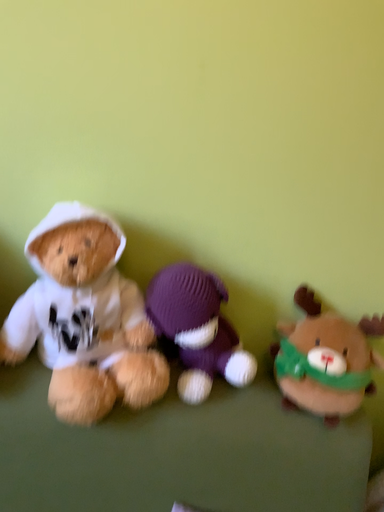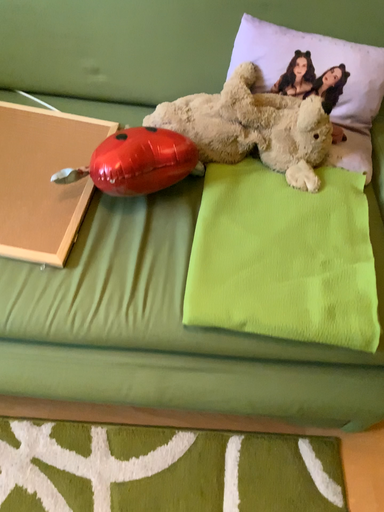
Question: Which way did the camera rotate in the video?

Choices:
 (A) rotated downward
 (B) rotated upward

Answer: (A)